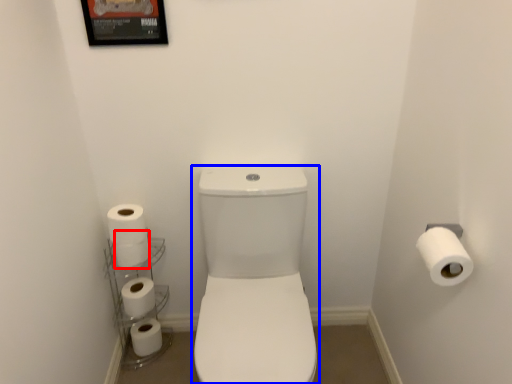
Question: Among these objects, which one is nearest to the camera, toilet paper (highlighted by a red box) or toilet bowl (highlighted by a blue box)?

Choices:
 (A) toilet paper
 (B) toilet bowl

Answer: (B)